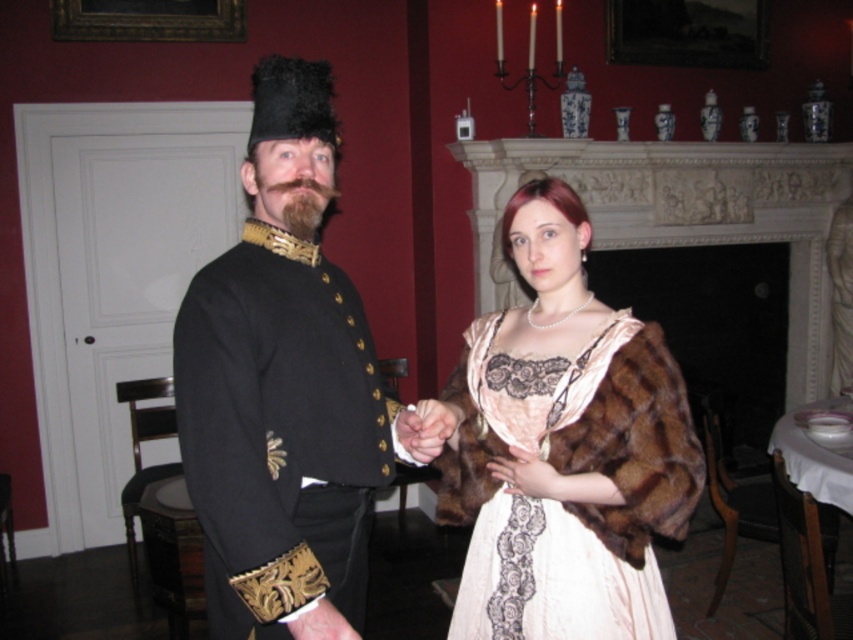
Is black wool military uniform at center positioned before velvet beige dress with lace at center?

Yes, black wool military uniform at center is in front of velvet beige dress with lace at center.

Find the location of a particular element. The height and width of the screenshot is (640, 853). black wool military uniform at center is located at coordinates (283, 388).

Who is more forward, (265, 74) or (665, 492)?

Point (265, 74)

Locate an element on the screen. black wool military uniform at center is located at coordinates (283, 388).

Which is in front, point (328, 102) or point (547, 496)?

Positioned in front is point (547, 496).

Which of these two, velvet black coat at left or brown fur hand at center, stands shorter?

With less height is brown fur hand at center.

What do you see at coordinates (561, 448) in the screenshot? This screenshot has height=640, width=853. I see `velvet black coat at left` at bounding box center [561, 448].

Where is `velvet black coat at left`? velvet black coat at left is located at coordinates (561, 448).

This screenshot has height=640, width=853. What do you see at coordinates (564, 448) in the screenshot?
I see `velvet beige dress with lace at center` at bounding box center [564, 448].

The image size is (853, 640). Identify the location of velvet beige dress with lace at center. (564, 448).